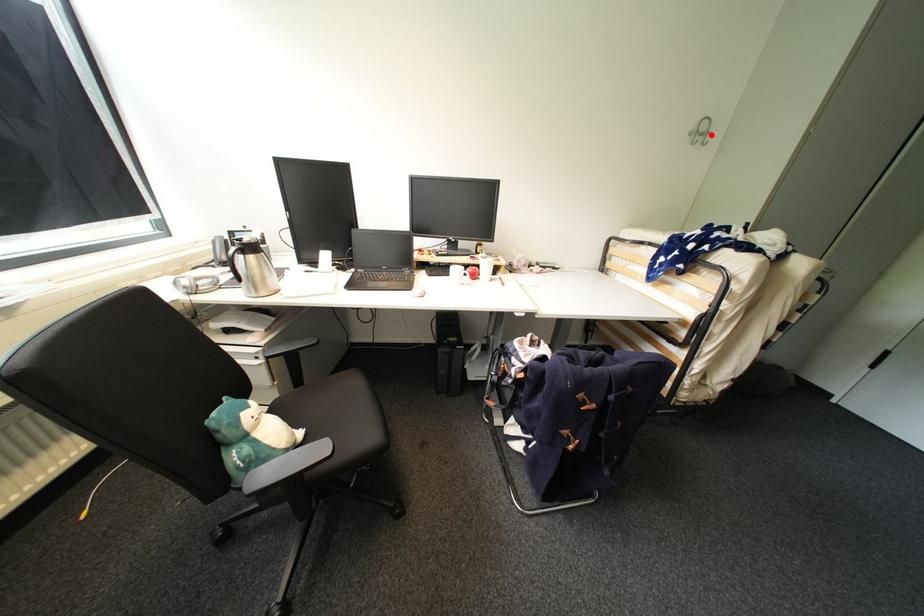
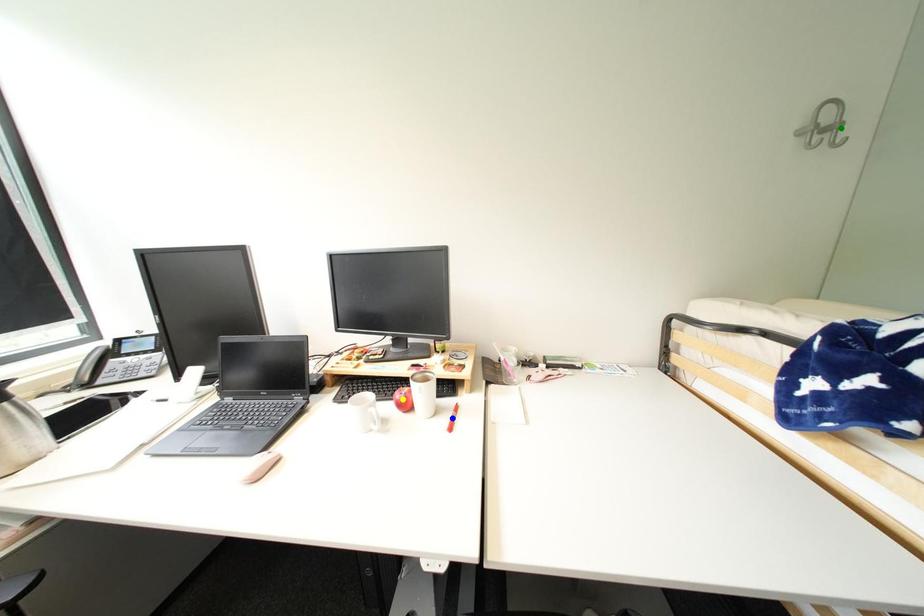
Question: I am providing you with two images of the same scene from different viewpoints. A red point is marked on the first image. You are given multiple points on the second image. Which point in image 2 is actually the same real-world point as the red point in image 1?

Choices:
 (A) green point
 (B) blue point
 (C) yellow point

Answer: (A)